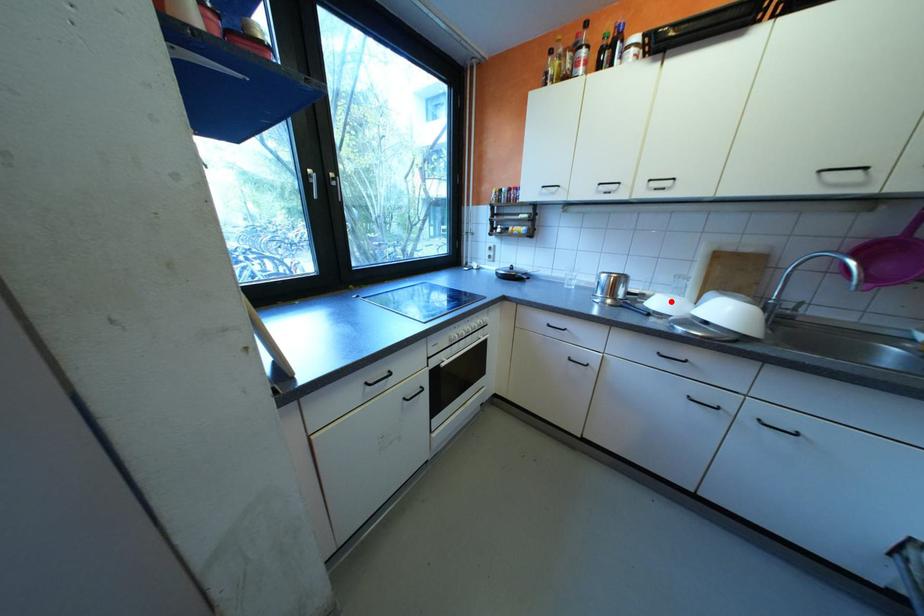
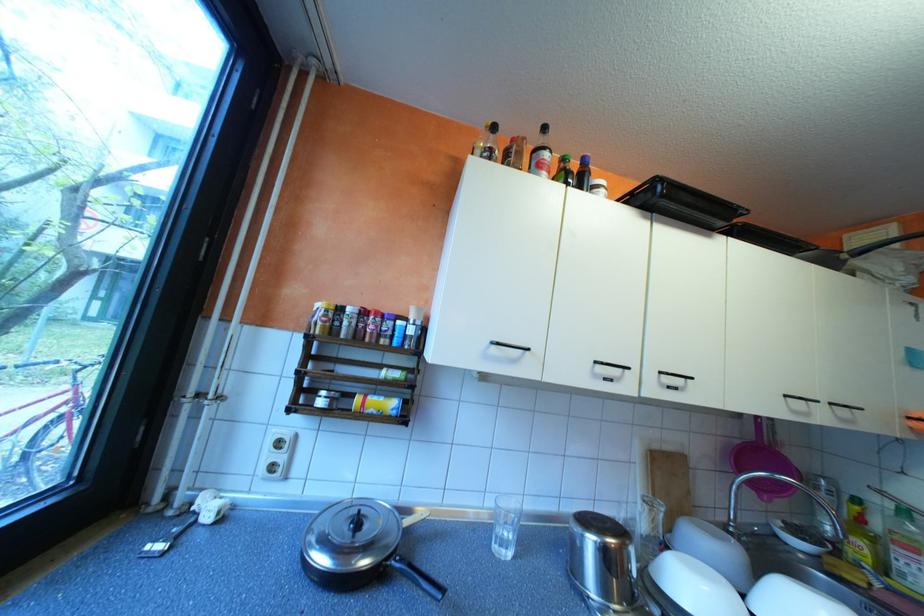
Find the pixel in the second image that matches the highlighted location in the first image.

(709, 592)